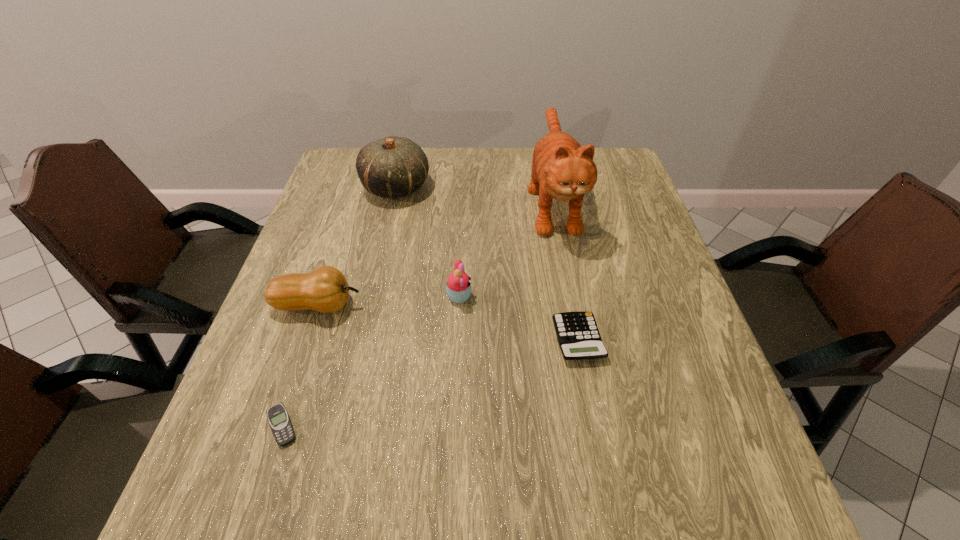
I want to click on blank area located on the stem side of the nearer gourd, so click(x=536, y=305).

What are the coordinates of `free location located on the face of the third object from right to left` in the screenshot? It's located at (575, 297).

Identify the location of vacant space positioned 0.170m on the back of the calculator. This screenshot has width=960, height=540. (564, 260).

Locate an element on the screen. The width and height of the screenshot is (960, 540). free space located on the front of the beeper is located at coordinates (258, 498).

This screenshot has width=960, height=540. I want to click on cat that is at the far edge, so click(561, 169).

The image size is (960, 540). Find the location of `gourd located in the far edge section of the desktop`. gourd located in the far edge section of the desktop is located at coordinates (392, 167).

This screenshot has height=540, width=960. I want to click on beeper that is positioned at the left edge, so click(x=280, y=423).

Where is `object at the far left corner`? object at the far left corner is located at coordinates (392, 167).

In the image, there is a desktop. Where is `free space at the far edge`? The image size is (960, 540). free space at the far edge is located at coordinates (456, 190).

What are the coordinates of `free location at the near edge` in the screenshot? It's located at (509, 515).